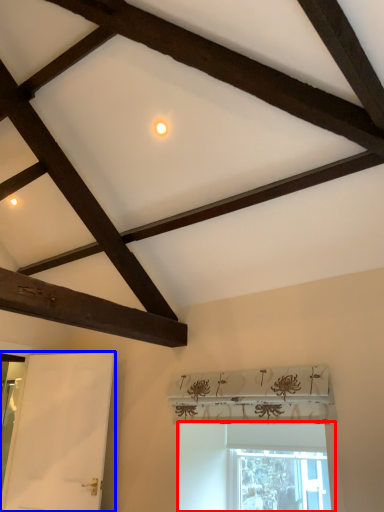
Question: Which object is closer to the camera taking this photo, window (highlighted by a red box) or screen door (highlighted by a blue box)?

Choices:
 (A) window
 (B) screen door

Answer: (A)